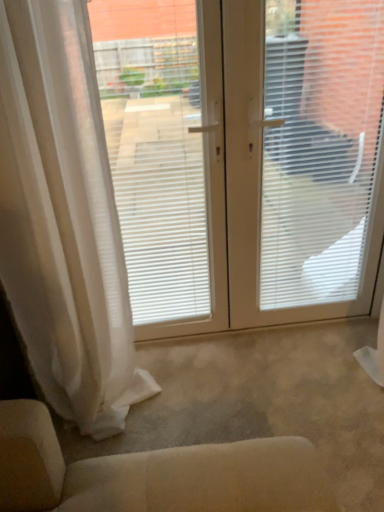
Question: Looking at the image, does white matte window screen at left, which is the first window screen in left-to-right order, seem bigger or smaller compared to white sheer curtain at left?

Choices:
 (A) small
 (B) big

Answer: (A)

Question: Is white matte window screen at left, marked as the 2th window screen in a right-to-left arrangement, in front of or behind white sheer curtain at left in the image?

Choices:
 (A) behind
 (B) front

Answer: (A)

Question: Considering the real-world distances, which object is closest to the white matte window screen at left, marked as the 2th window screen in a right-to-left arrangement?

Choices:
 (A) white sheer curtain at left
 (B) white matte window blind at center
 (C) white plastic window screen at center, which is counted as the first window screen, starting from the right

Answer: (C)

Question: Which of these objects is positioned closest to the white plastic window screen at center, which is counted as the first window screen, starting from the right?

Choices:
 (A) white sheer curtain at left
 (B) white matte window screen at left, which is the first window screen in left-to-right order
 (C) white matte window blind at center

Answer: (C)